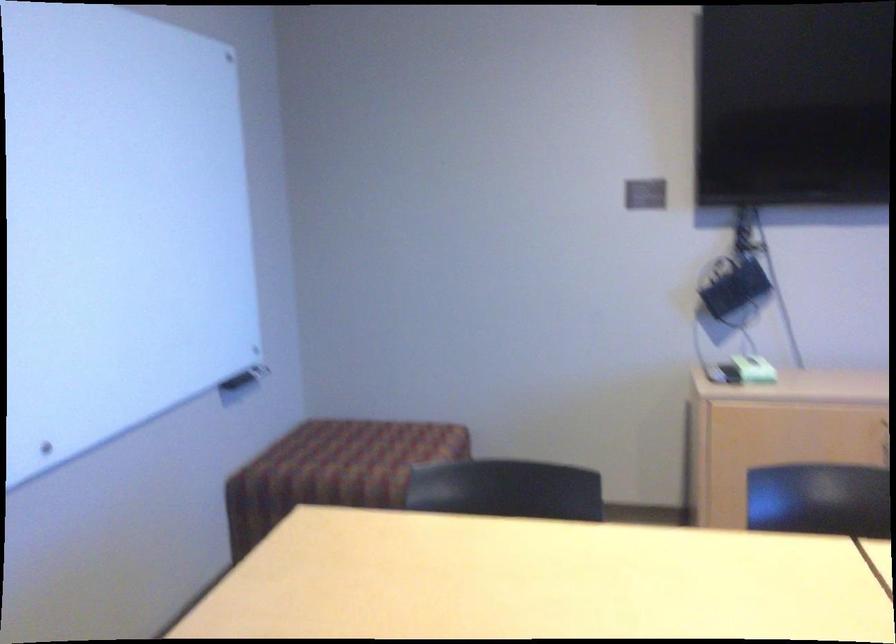
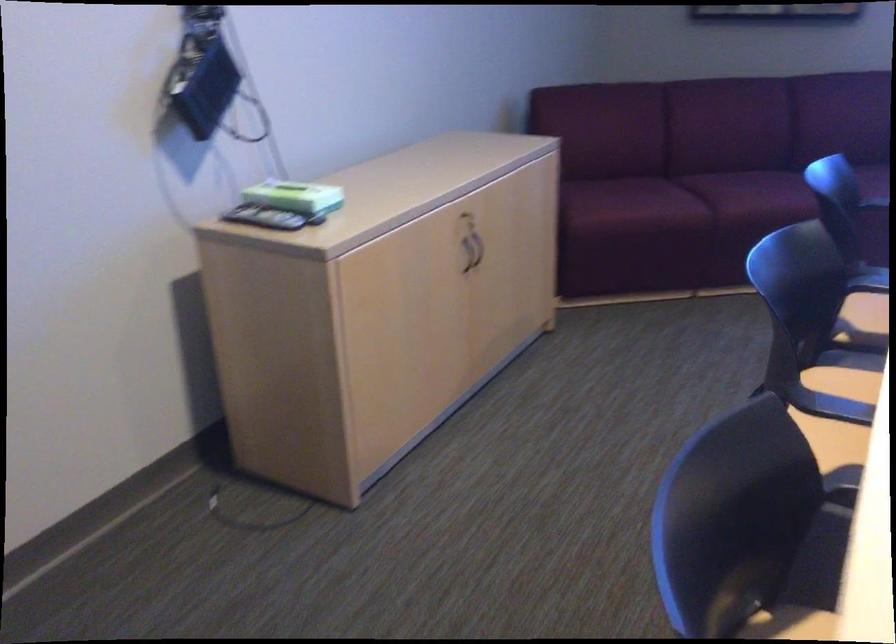
Question: I am providing you with two images of the same scene from different viewpoints. Which of the following objects are not visible in image2?

Choices:
 (A) chair sitting surface
 (B) cabinet door handle
 (C) remote control
 (D) none of these

Answer: (D)